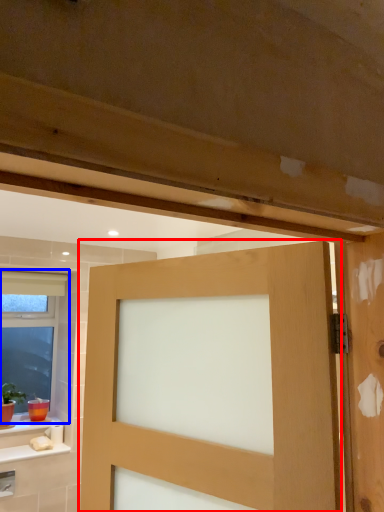
Question: Which of the following is the farthest to the observer, door (highlighted by a red box) or window (highlighted by a blue box)?

Choices:
 (A) door
 (B) window

Answer: (B)